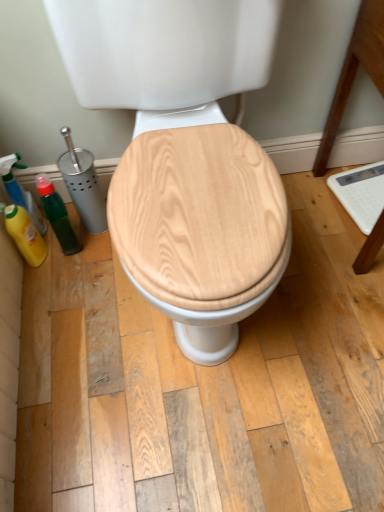
The image size is (384, 512). What are the coordinates of `vacant area located to the right-hand side of wooden toilet seat at center` in the screenshot? It's located at (326, 273).